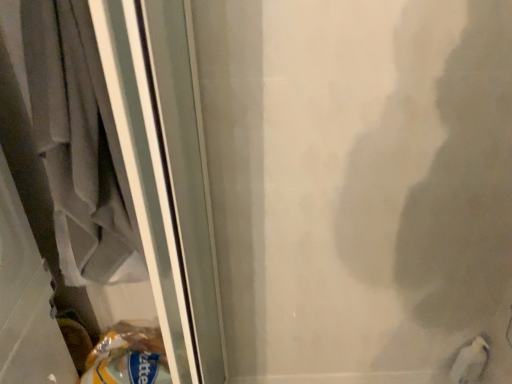
Question: From the image's perspective, is gray fabric laundry at left located above or below white matte bird at lower right?

Choices:
 (A) above
 (B) below

Answer: (A)

Question: Is gray fabric laundry at left inside or outside of white matte bird at lower right?

Choices:
 (A) inside
 (B) outside

Answer: (B)

Question: Considering the positions of gray fabric laundry at left and white matte bird at lower right in the image, is gray fabric laundry at left wider or thinner than white matte bird at lower right?

Choices:
 (A) thin
 (B) wide

Answer: (B)

Question: From the image's perspective, is white matte bird at lower right above or below gray fabric laundry at left?

Choices:
 (A) above
 (B) below

Answer: (B)

Question: From a real-world perspective, is white matte bird at lower right physically located above or below gray fabric laundry at left?

Choices:
 (A) above
 (B) below

Answer: (B)

Question: Is white matte bird at lower right taller or shorter than gray fabric laundry at left?

Choices:
 (A) tall
 (B) short

Answer: (B)

Question: In the image, is white matte bird at lower right on the left side or the right side of gray fabric laundry at left?

Choices:
 (A) right
 (B) left

Answer: (A)